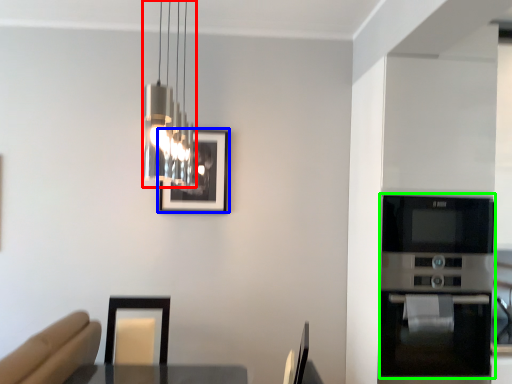
Question: Based on their relative distances, which object is nearer to lamp (highlighted by a red box)? Choose from picture frame (highlighted by a blue box) and appliance (highlighted by a green box).

Choices:
 (A) picture frame
 (B) appliance

Answer: (A)